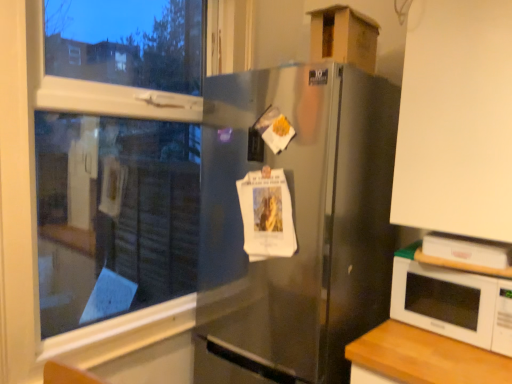
Question: From a real-world perspective, relative to transparent glass window at upper left, is satin silver refrigerator at center vertically above or below?

Choices:
 (A) above
 (B) below

Answer: (B)

Question: Considering the positions of satin silver refrigerator at center and transparent glass window at upper left in the image, is satin silver refrigerator at center taller or shorter than transparent glass window at upper left?

Choices:
 (A) tall
 (B) short

Answer: (A)

Question: Estimate the real-world distances between objects in this image. Which object is closer to the satin silver refrigerator at center?

Choices:
 (A) white glossy microwave at lower right
 (B) transparent glass window at upper left
 (C) cardboard box at upper right
 (D) white matte cabinet at upper right

Answer: (D)

Question: Estimate the real-world distances between objects in this image. Which object is farther from the white matte cabinet at upper right?

Choices:
 (A) transparent glass window at upper left
 (B) satin silver refrigerator at center
 (C) cardboard box at upper right
 (D) white glossy microwave at lower right

Answer: (A)